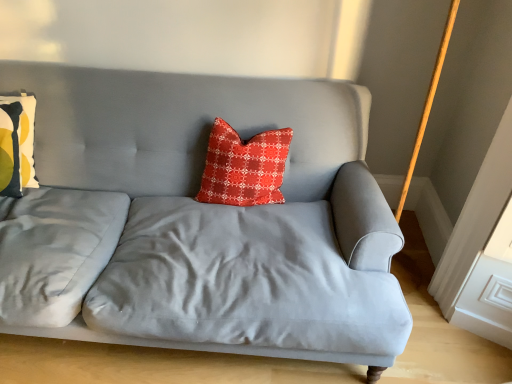
Describe the element at coordinates (244, 167) in the screenshot. The width and height of the screenshot is (512, 384). I see `red textured pillow at center, which is counted as the 1th pillow, starting from the right` at that location.

The height and width of the screenshot is (384, 512). Identify the location of red textured pillow at center, which is counted as the 1th pillow, starting from the right. (244, 167).

What is the approximate width of satin gray couch at center?

1.03 meters.

I want to click on matte yellow-green pillow at left, placed as the second pillow when sorted from right to left, so click(x=17, y=144).

Is point (236, 195) more distant than point (28, 136)?

No, (236, 195) is in front of (28, 136).

From a real-world perspective, does red textured pillow at center, which is counted as the 1th pillow, starting from the right, sit lower than matte yellow-green pillow at left, placed as the second pillow when sorted from right to left?

No, from a real-world perspective, red textured pillow at center, which is counted as the 1th pillow, starting from the right, is not under matte yellow-green pillow at left, placed as the second pillow when sorted from right to left.

From their relative heights in the image, would you say red textured pillow at center, which is counted as the 1th pillow, starting from the right, is taller or shorter than matte yellow-green pillow at left, placed as the second pillow when sorted from right to left?

red textured pillow at center, which is counted as the 1th pillow, starting from the right, is shorter than matte yellow-green pillow at left, placed as the second pillow when sorted from right to left.

Does red textured pillow at center, which is counted as the 1th pillow, starting from the right, lie behind matte yellow-green pillow at left, placed as the second pillow when sorted from right to left?

Yes, the depth of red textured pillow at center, which is counted as the 1th pillow, starting from the right, is greater than that of matte yellow-green pillow at left, placed as the second pillow when sorted from right to left.

Is point (232, 189) less distant than point (143, 162)?

That is True.

Which object is further away from the camera taking this photo, red textured pillow at center, which is counted as the 1th pillow, starting from the right, or satin gray couch at center?

Positioned behind is red textured pillow at center, which is counted as the 1th pillow, starting from the right.

Is red textured pillow at center, which is the second pillow in left-to-right order, touching satin gray couch at center?

There is a gap between red textured pillow at center, which is the second pillow in left-to-right order, and satin gray couch at center.

Where is `studio couch in front of the red textured pillow at center, which is counted as the 1th pillow, starting from the right`? Image resolution: width=512 pixels, height=384 pixels. studio couch in front of the red textured pillow at center, which is counted as the 1th pillow, starting from the right is located at coordinates (199, 221).

Is satin gray couch at center wider than matte yellow-green pillow at left, which is the 1th pillow from left to right?

Yes.

Consider the image. Is matte yellow-green pillow at left, placed as the second pillow when sorted from right to left, surrounded by satin gray couch at center?

Indeed, matte yellow-green pillow at left, placed as the second pillow when sorted from right to left, is located within satin gray couch at center.

From a real-world perspective, between satin gray couch at center and matte yellow-green pillow at left, which is the 1th pillow from left to right, who is vertically higher?

matte yellow-green pillow at left, which is the 1th pillow from left to right.

Is satin gray couch at center closer to the viewer compared to matte yellow-green pillow at left, placed as the second pillow when sorted from right to left?

Yes, it is in front of matte yellow-green pillow at left, placed as the second pillow when sorted from right to left.

From the image's perspective, which object appears higher, satin gray couch at center or red textured pillow at center, which is the second pillow in left-to-right order?

red textured pillow at center, which is the second pillow in left-to-right order, appears higher in the image.

Between satin gray couch at center and red textured pillow at center, which is the second pillow in left-to-right order, which one has larger size?

Bigger between the two is satin gray couch at center.

Considering the positions of objects satin gray couch at center and red textured pillow at center, which is the second pillow in left-to-right order, in the image provided, who is in front, satin gray couch at center or red textured pillow at center, which is the second pillow in left-to-right order,?

satin gray couch at center is closer to the camera.

Looking at this image, is matte yellow-green pillow at left, placed as the second pillow when sorted from right to left, at the right side of satin gray couch at center?

No.

Is matte yellow-green pillow at left, placed as the second pillow when sorted from right to left, not within satin gray couch at center?

No, most part of matte yellow-green pillow at left, placed as the second pillow when sorted from right to left, lies within satin gray couch at center.

Can you confirm if matte yellow-green pillow at left, placed as the second pillow when sorted from right to left, is taller than satin gray couch at center?

No, matte yellow-green pillow at left, placed as the second pillow when sorted from right to left, is not taller than satin gray couch at center.

Which point is more forward, (31, 95) or (128, 341)?

The point (128, 341) is more forward.

Which point is more forward, (18, 111) or (222, 195)?

The point (222, 195) is in front.

Is matte yellow-green pillow at left, placed as the second pillow when sorted from right to left, aimed at red textured pillow at center, which is counted as the 1th pillow, starting from the right?

No, matte yellow-green pillow at left, placed as the second pillow when sorted from right to left, is not oriented towards red textured pillow at center, which is counted as the 1th pillow, starting from the right.

Does matte yellow-green pillow at left, placed as the second pillow when sorted from right to left, lie behind red textured pillow at center, which is the second pillow in left-to-right order?

No, it is in front of red textured pillow at center, which is the second pillow in left-to-right order.

Which object is thinner, matte yellow-green pillow at left, placed as the second pillow when sorted from right to left, or red textured pillow at center, which is the second pillow in left-to-right order?

matte yellow-green pillow at left, placed as the second pillow when sorted from right to left, is thinner.

Locate an element on the screen. This screenshot has height=384, width=512. pillow below the red textured pillow at center, which is the second pillow in left-to-right order (from a real-world perspective) is located at coordinates (17, 144).

At what (x,y) coordinates should I click in order to perform the action: click on studio couch below the red textured pillow at center, which is counted as the 1th pillow, starting from the right (from the image's perspective). Please return your answer as a coordinate pair (x, y). The height and width of the screenshot is (384, 512). Looking at the image, I should click on (199, 221).

When comparing their distances from matte yellow-green pillow at left, placed as the second pillow when sorted from right to left, does red textured pillow at center, which is the second pillow in left-to-right order, or satin gray couch at center seem closer?

Based on the image, satin gray couch at center appears to be nearer to matte yellow-green pillow at left, placed as the second pillow when sorted from right to left.

Looking at the image, which one is located closer to red textured pillow at center, which is counted as the 1th pillow, starting from the right, satin gray couch at center or matte yellow-green pillow at left, placed as the second pillow when sorted from right to left?

satin gray couch at center.

From the image, which object appears to be farther from matte yellow-green pillow at left, which is the 1th pillow from left to right, satin gray couch at center or red textured pillow at center, which is counted as the 1th pillow, starting from the right?

Among the two, red textured pillow at center, which is counted as the 1th pillow, starting from the right, is located further to matte yellow-green pillow at left, which is the 1th pillow from left to right.

When comparing their distances from red textured pillow at center, which is counted as the 1th pillow, starting from the right, does matte yellow-green pillow at left, which is the 1th pillow from left to right, or satin gray couch at center seem closer?

satin gray couch at center is closer to red textured pillow at center, which is counted as the 1th pillow, starting from the right.

Considering their positions, is matte yellow-green pillow at left, which is the 1th pillow from left to right, positioned closer to satin gray couch at center than red textured pillow at center, which is the second pillow in left-to-right order?

Based on the image, red textured pillow at center, which is the second pillow in left-to-right order, appears to be nearer to satin gray couch at center.

Consider the image. From the image, which object appears to be nearer to satin gray couch at center, red textured pillow at center, which is counted as the 1th pillow, starting from the right, or matte yellow-green pillow at left, which is the 1th pillow from left to right?

Among the two, red textured pillow at center, which is counted as the 1th pillow, starting from the right, is located nearer to satin gray couch at center.

Where is `studio couch between matte yellow-green pillow at left, which is the 1th pillow from left to right, and red textured pillow at center, which is the second pillow in left-to-right order, in the horizontal direction`? This screenshot has width=512, height=384. studio couch between matte yellow-green pillow at left, which is the 1th pillow from left to right, and red textured pillow at center, which is the second pillow in left-to-right order, in the horizontal direction is located at coordinates (199, 221).